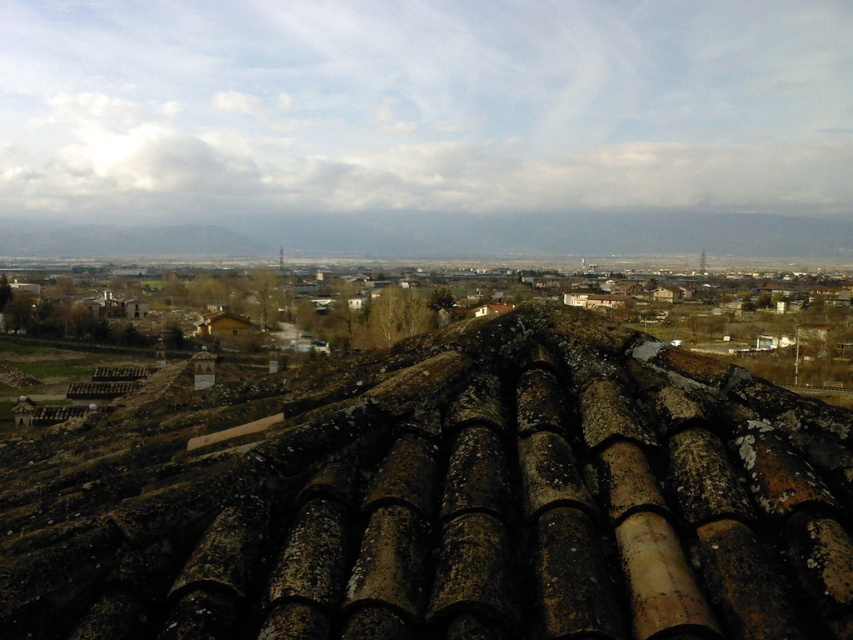
Question: Does brown/weathered tile roof at center appear on the left side of brown textured building at center?

Choices:
 (A) yes
 (B) no

Answer: (A)

Question: Does brown/weathered tile roof at center have a smaller size compared to brown textured building at center?

Choices:
 (A) no
 (B) yes

Answer: (B)

Question: Which of the following is the farthest from the observer?

Choices:
 (A) (720, 355)
 (B) (299, 577)

Answer: (A)

Question: Can you confirm if brown/weathered tile roof at center is positioned below brown textured building at center?

Choices:
 (A) yes
 (B) no

Answer: (A)

Question: Which object appears closest to the camera in this image?

Choices:
 (A) brown textured building at center
 (B) brown/weathered tile roof at center

Answer: (B)